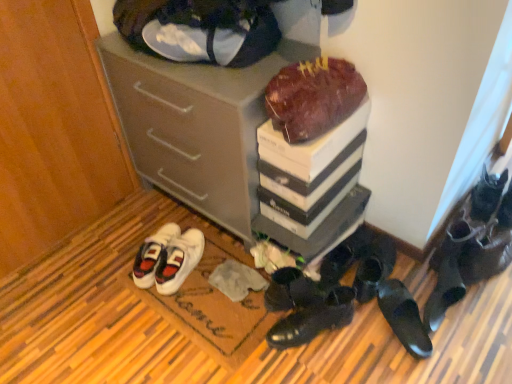
This screenshot has width=512, height=384. I want to click on empty space that is to the right of black leather shoes at lower center, acting as the second footwear starting from the left, so click(x=365, y=344).